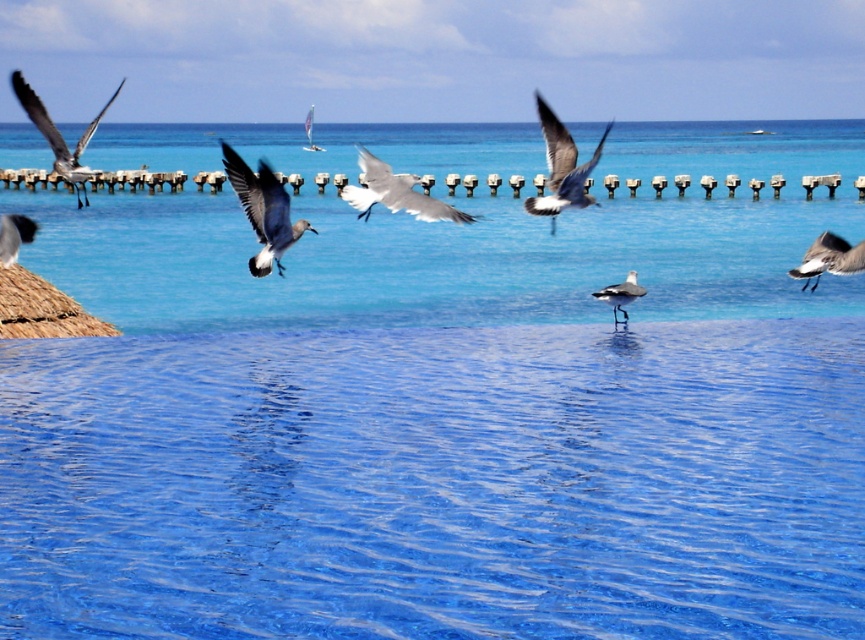
You are a photographer standing at the water edge. You want to take a photo of the gray matte seagull at upper left and the white feathered seagull at right. If your camera can focus on objects up to 15 meters away, will both seagulls be in focus?

The gray matte seagull at upper left is 14.43 meters from the white feathered seagull at right. Since the camera can focus up to 15 meters, both seagulls are within the focus range and will be in focus.

You are a birdwatcher trying to identify birds in the image. You notice the white feathered seagull at right and the matte black bird at left. Which bird has a larger wingspan?

The white feathered seagull at right might have a larger wingspan than the matte black bird at left according to the description.

You are standing at the camera position and want to take a photo of the white glossy seagull at center. If your camera has a maximum focus range of 15 meters, will you be able to capture the seagull clearly?

The white glossy seagull at center and camera are 14.15 meters apart, so yes, the camera can focus on the seagull clearly since the distance is within the 15 meters maximum focus range.